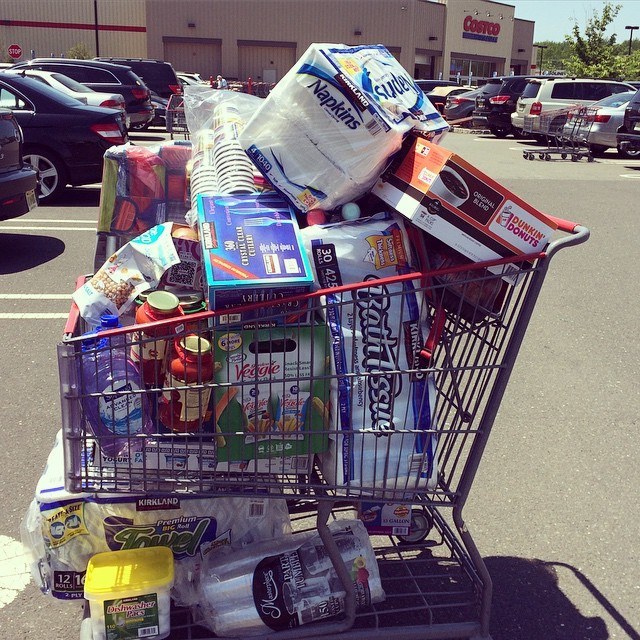
The height and width of the screenshot is (640, 640). What are the coordinates of `paper cups` in the screenshot? It's located at (236, 169).